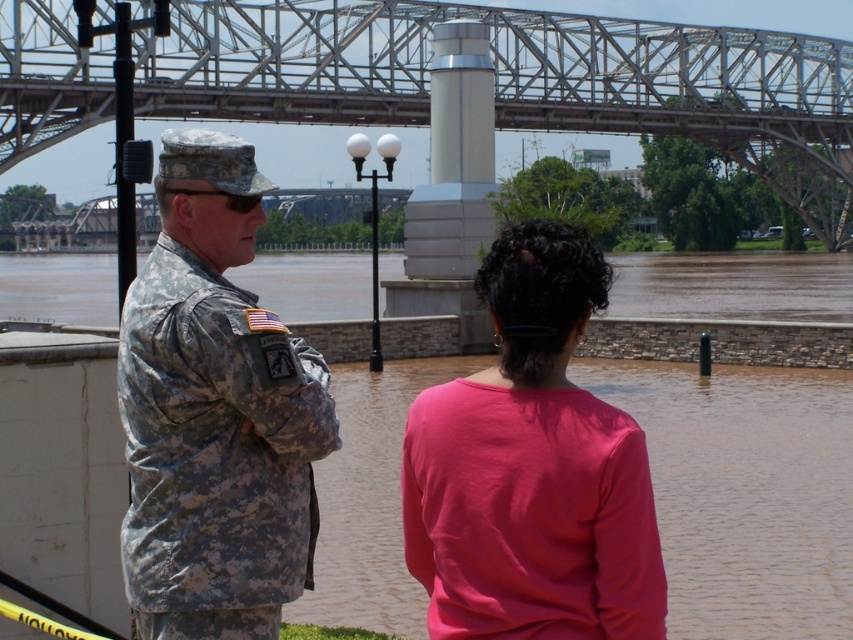
Based on the photo, does camouflage uniform at left have a greater width compared to metallic steel bridge at upper center?

In fact, camouflage uniform at left might be narrower than metallic steel bridge at upper center.

What do you see at coordinates (215, 413) in the screenshot? I see `camouflage uniform at left` at bounding box center [215, 413].

Between point (640, 480) and point (494, 19), which one is positioned in front?

Point (640, 480) is more forward.

This screenshot has height=640, width=853. I want to click on camouflage uniform at left, so click(215, 413).

Which is in front, point (161, 499) or point (288, 589)?

Point (161, 499) is in front.

Based on the photo, between camouflage uniform at left and camouflage uniform at center, which one appears on the left side from the viewer's perspective?

Positioned to the left is camouflage uniform at center.

I want to click on camouflage uniform at left, so click(x=215, y=413).

Between metallic steel bridge at upper center and pink matte shirt at center, which one is positioned lower?

Positioned lower is pink matte shirt at center.

Who is more forward, (x=62, y=90) or (x=532, y=221)?

Positioned in front is point (x=532, y=221).

Identify the location of metallic steel bridge at upper center. (521, 81).